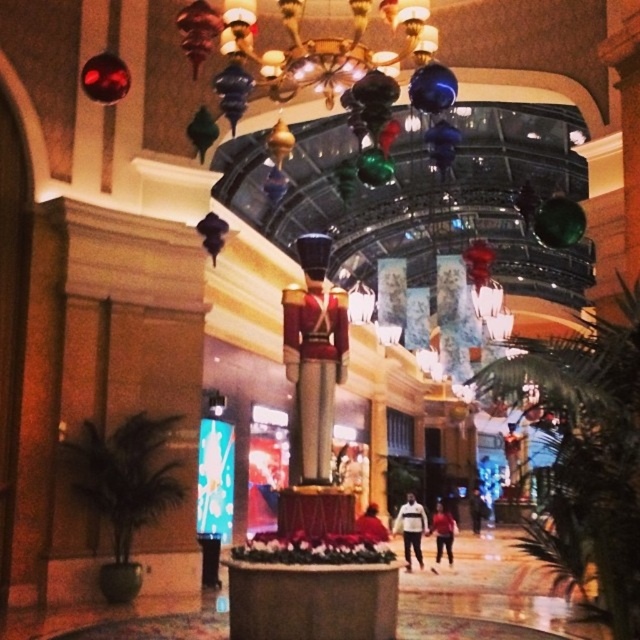
What is located at the point with coordinates (410, 529) in the image?

The white matte jacket at center is located at point (410, 529).

You are standing in the mall and want to determine which of the two points, point [417,557] or point [474,502], is closer to you. Based on the scene description, which point is nearer?

Point [417,557] is closer to the viewer than point [474,502].